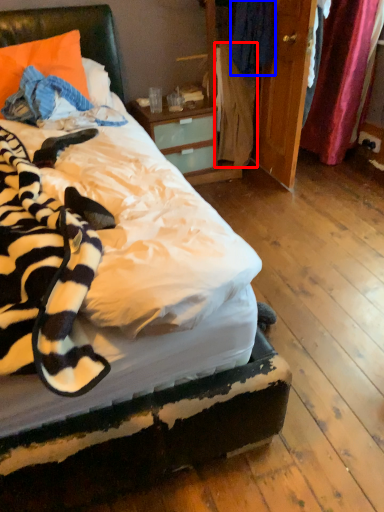
Question: Which object appears closest to the camera in this image, clothing (highlighted by a red box) or clothing (highlighted by a blue box)?

Choices:
 (A) clothing
 (B) clothing

Answer: (B)